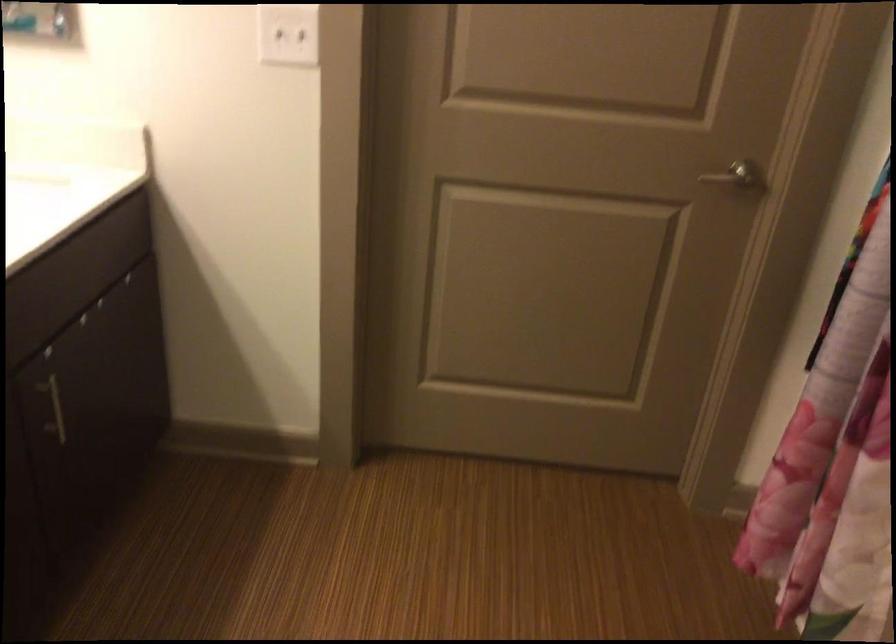
Where is `white power outlet`? white power outlet is located at coordinates (288, 35).